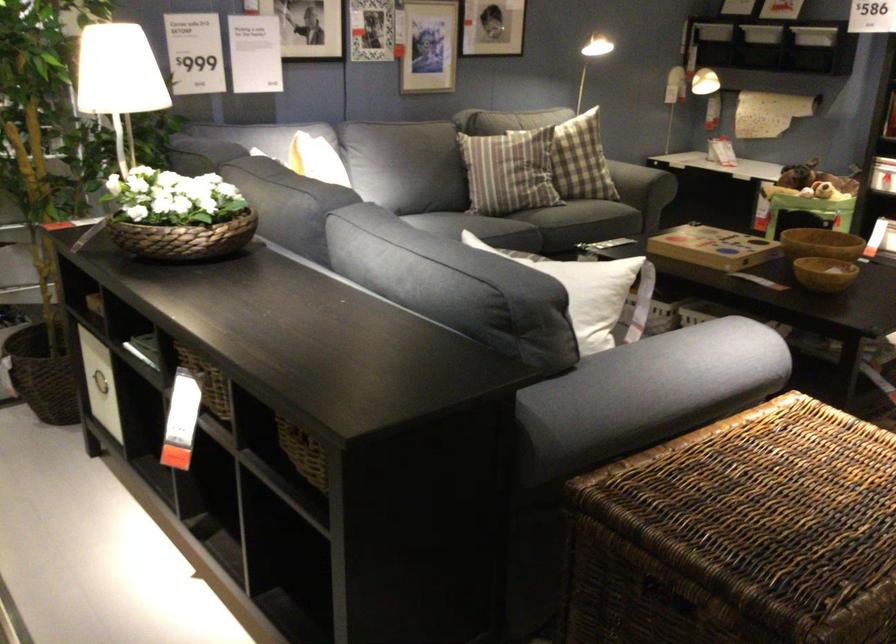
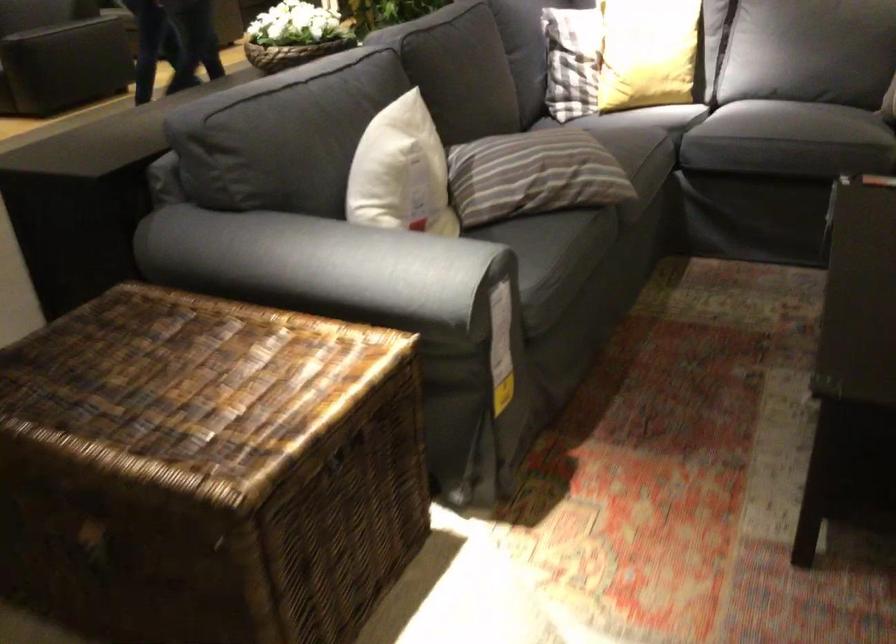
Find the pixel in the second image that matches point 588,281 in the first image.

(401, 172)